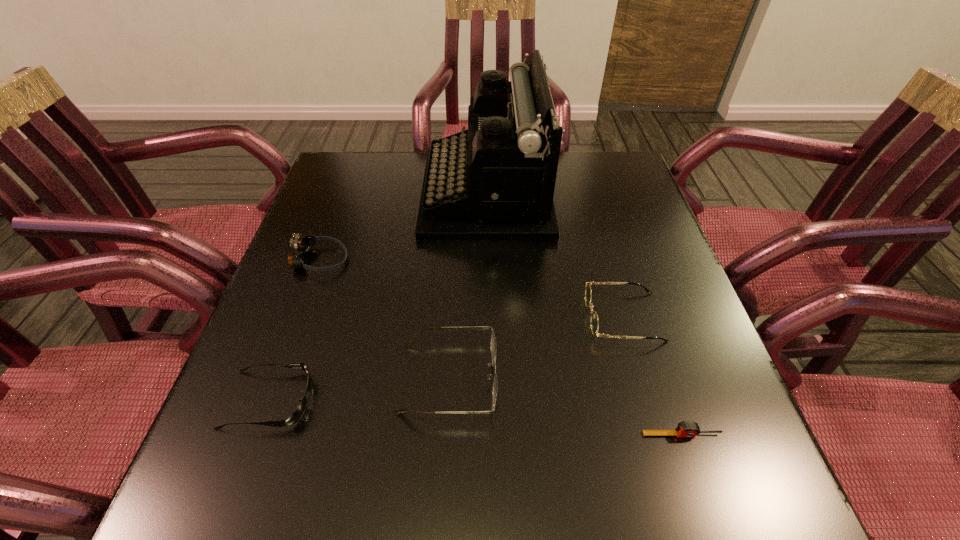
What are the coordinates of `blank area in the image that satisfies the following two spatial constraints: 1. on the lenses of the right spectacles; 2. on the right side of the tape measure` in the screenshot? It's located at (658, 435).

The image size is (960, 540). I want to click on free space that satisfies the following two spatial constraints: 1. on the back side of the tape measure; 2. through the lenses of the goggles, so click(x=624, y=260).

Where is `free point that satisfies the following two spatial constraints: 1. on the lenses of the right spectacles; 2. on the left side of the tape measure`? free point that satisfies the following two spatial constraints: 1. on the lenses of the right spectacles; 2. on the left side of the tape measure is located at coordinates (658, 435).